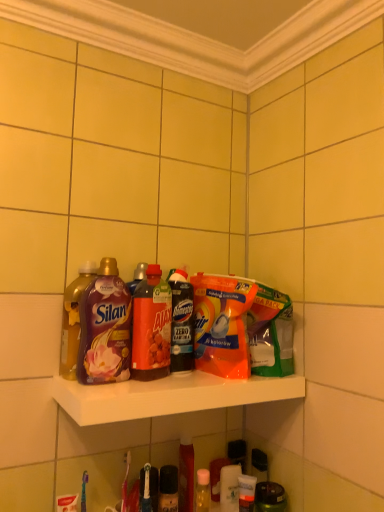
Question: Does white glossy shelf at center come in front of matte plastic bottle at left, arranged as the 2th bottle when viewed from the left?

Choices:
 (A) no
 (B) yes

Answer: (B)

Question: From a real-world perspective, is white glossy shelf at center positioned under matte plastic bottle at left, arranged as the 2th bottle when viewed from the left, based on gravity?

Choices:
 (A) yes
 (B) no

Answer: (A)

Question: Considering the relative sizes of white glossy shelf at center and matte plastic bottle at left, arranged as the 2th bottle when viewed from the left, in the image provided, is white glossy shelf at center bigger than matte plastic bottle at left, arranged as the 2th bottle when viewed from the left,?

Choices:
 (A) no
 (B) yes

Answer: (B)

Question: Is white glossy shelf at center thinner than matte plastic bottle at left, the third bottle in the right-to-left sequence?

Choices:
 (A) no
 (B) yes

Answer: (A)

Question: Does white glossy shelf at center have a smaller size compared to matte plastic bottle at left, arranged as the 2th bottle when viewed from the left?

Choices:
 (A) no
 (B) yes

Answer: (A)

Question: Can you see white glossy shelf at center touching matte plastic bottle at left, arranged as the 2th bottle when viewed from the left?

Choices:
 (A) no
 (B) yes

Answer: (A)

Question: Is orange plastic dishwashing liquid at center positioned before shiny purple bottle at left, marked as the fourth bottle in a right-to-left arrangement?

Choices:
 (A) no
 (B) yes

Answer: (A)

Question: Is orange plastic dishwashing liquid at center turned away from shiny purple bottle at left, marked as the fourth bottle in a right-to-left arrangement?

Choices:
 (A) no
 (B) yes

Answer: (A)

Question: Would you say orange plastic dishwashing liquid at center is a long distance from shiny purple bottle at left, marked as the fourth bottle in a right-to-left arrangement?

Choices:
 (A) yes
 (B) no

Answer: (B)

Question: Is orange plastic dishwashing liquid at center facing towards shiny purple bottle at left, marked as the fourth bottle in a right-to-left arrangement?

Choices:
 (A) yes
 (B) no

Answer: (B)

Question: Considering the relative sizes of orange plastic dishwashing liquid at center and shiny purple bottle at left, acting as the 1th bottle starting from the left, in the image provided, is orange plastic dishwashing liquid at center smaller than shiny purple bottle at left, acting as the 1th bottle starting from the left,?

Choices:
 (A) no
 (B) yes

Answer: (A)

Question: Is orange plastic dishwashing liquid at center wider than shiny purple bottle at left, marked as the fourth bottle in a right-to-left arrangement?

Choices:
 (A) yes
 (B) no

Answer: (A)

Question: From a real-world perspective, is translucent orange bottle at center, the 2th bottle when ordered from right to left, positioned over matte plastic bottle at left, arranged as the 2th bottle when viewed from the left, based on gravity?

Choices:
 (A) no
 (B) yes

Answer: (A)